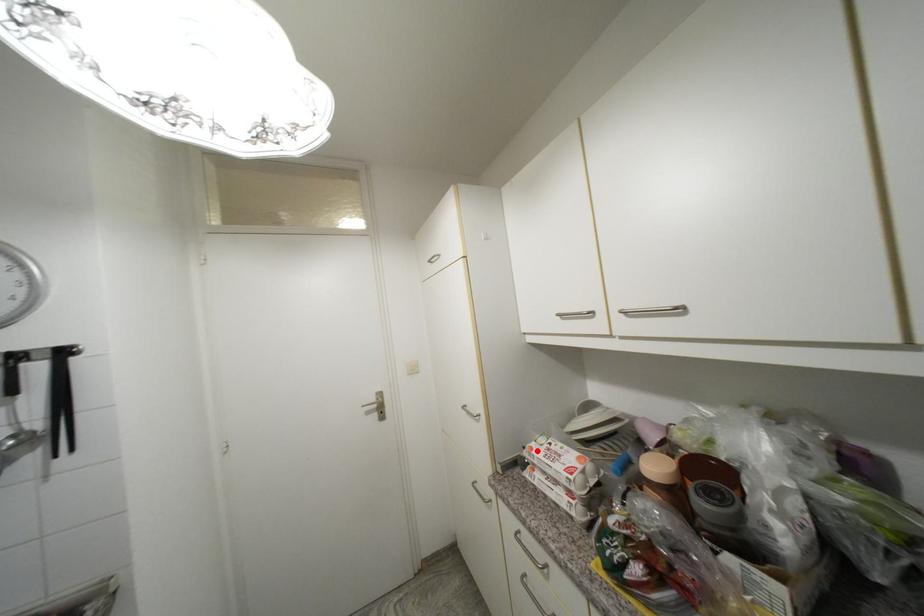
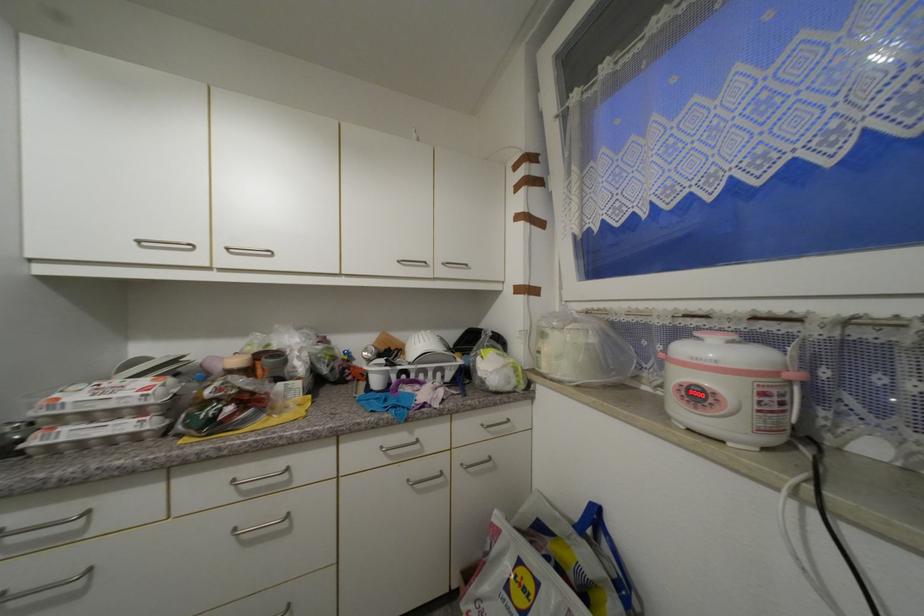
Where in the second image is the point corresponding to the highlighted location from the first image?

(64, 400)